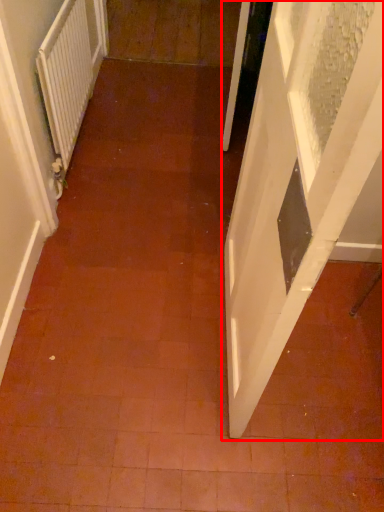
Question: Where is door (annotated by the red box) located in relation to radiator in the image?

Choices:
 (A) left
 (B) right

Answer: (B)